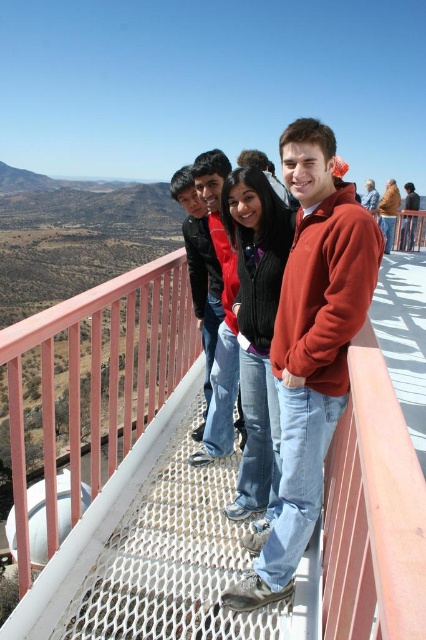
Can you confirm if metal mesh balcony at center is shorter than matte orange jacket at center?

In fact, metal mesh balcony at center may be taller than matte orange jacket at center.

What do you see at coordinates (196, 484) in the screenshot?
I see `metal mesh balcony at center` at bounding box center [196, 484].

Between point (403, 339) and point (409, 216), which one is positioned in front?

Positioned in front is point (403, 339).

You are a GUI agent. You are given a task and a screenshot of the screen. Output one action in this format:
    pyautogui.click(x=<x>, y=<y>)
    Task: Click on the metal mesh balcony at center
    Image resolution: width=426 pixels, height=640 pixels.
    Given the screenshot: What is the action you would take?
    pyautogui.click(x=196, y=484)

Does metal mesh balcony at center have a larger size compared to orange cotton sweater at center?

Yes, metal mesh balcony at center is bigger than orange cotton sweater at center.

Who is lower down, metal mesh balcony at center or orange cotton sweater at center?

Positioned lower is metal mesh balcony at center.

The image size is (426, 640). Find the location of `metal mesh balcony at center`. metal mesh balcony at center is located at coordinates (196, 484).

Between matte red jacket at center and matte orange sweater at center, which one is positioned higher?

matte orange sweater at center

Who is positioned more to the left, matte red jacket at center or matte orange sweater at center?

matte red jacket at center

Measure the distance between matte red jacket at center and camera.

The distance of matte red jacket at center from camera is 17.06 meters.

Identify the location of matte red jacket at center. (218, 240).